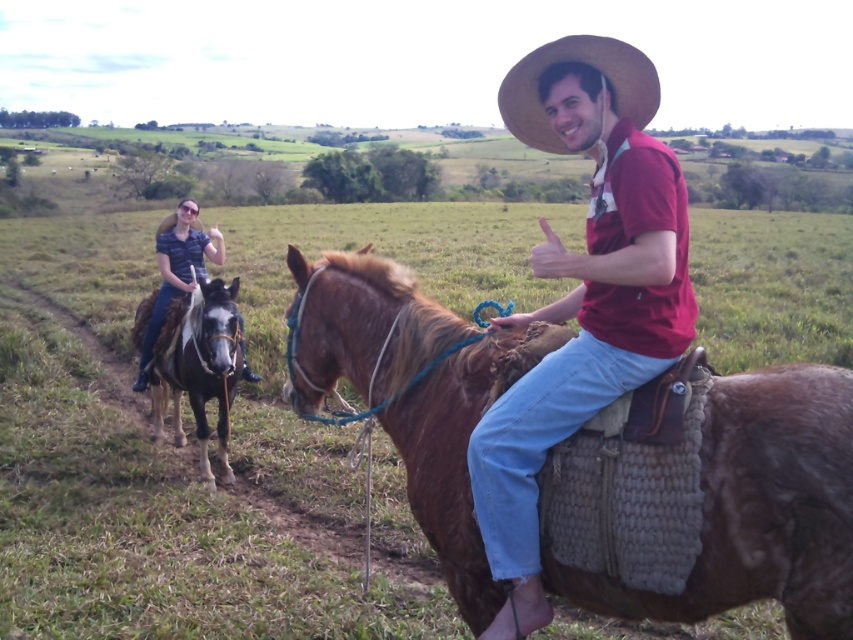
You are a photographer trying to capture a clear shot of the matte red shirt at center and the black glossy horse at left. Based on their positions, which object would you focus on first to ensure both are in focus?

The matte red shirt at center is above the black glossy horse at left, so focusing on the black glossy horse at left first would ensure both are in focus since it is closer to the camera.